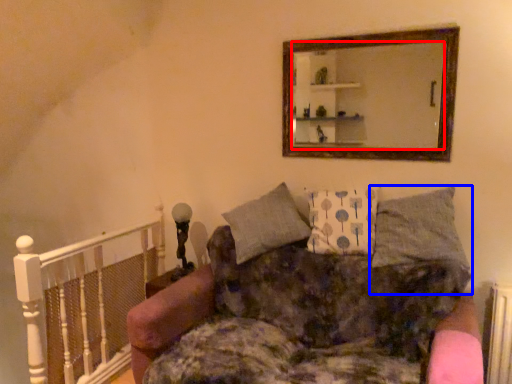
Question: Which object is further to the camera taking this photo, mirror (highlighted by a red box) or pillow (highlighted by a blue box)?

Choices:
 (A) mirror
 (B) pillow

Answer: (A)